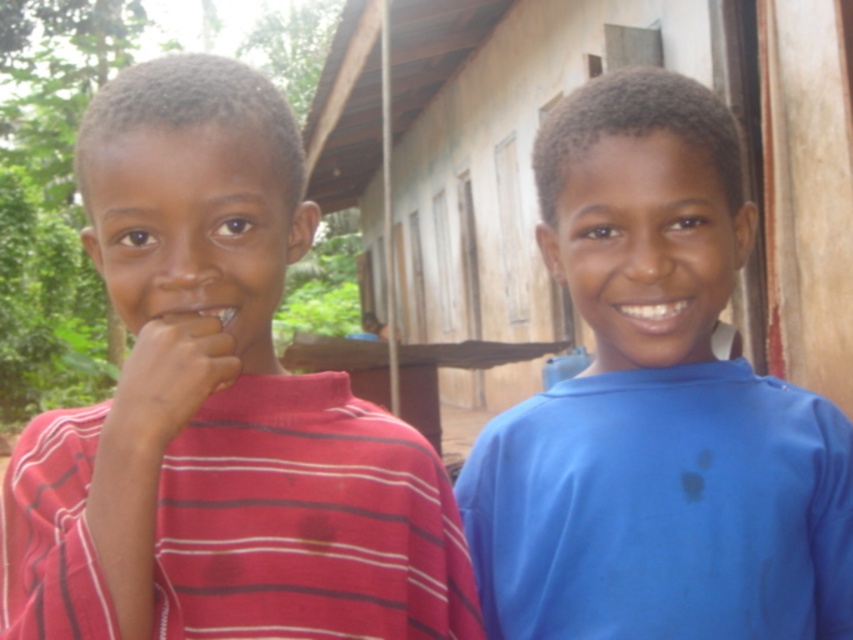
You are a photographer trying to capture both the striped cotton shirt at left and the matte skin hand at left in a single frame. Given that your camera has a limited focus range, which object should you prioritize focusing on to ensure it appears clearer in the photo?

The striped cotton shirt at left is larger in size than the matte skin hand at left, so focusing on the striped cotton shirt at left would ensure it appears clearer in the photo.

You are a photographer standing 20 inches away from the striped cotton shirt at left. Can you safely step forward to take a closer photo without getting too close?

The striped cotton shirt at left and viewer are 22.67 inches apart from each other. Since you are currently 20 inches away, you are already closer than the stated distance, so stepping forward would make you even closer. However, the original description might indicate the default distance, so there might be an inconsistency. Please clarify the exact positioning.

What are the coordinates of the striped cotton shirt at left?

The striped cotton shirt at left is located at point (218, 410).